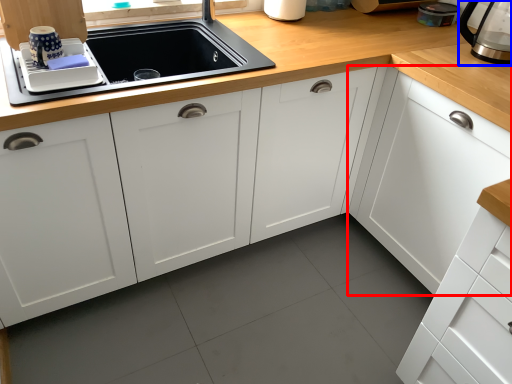
Question: Which point is further to the camera, cabinetry (highlighted by a red box) or coffeepot (highlighted by a blue box)?

Choices:
 (A) cabinetry
 (B) coffeepot

Answer: (B)